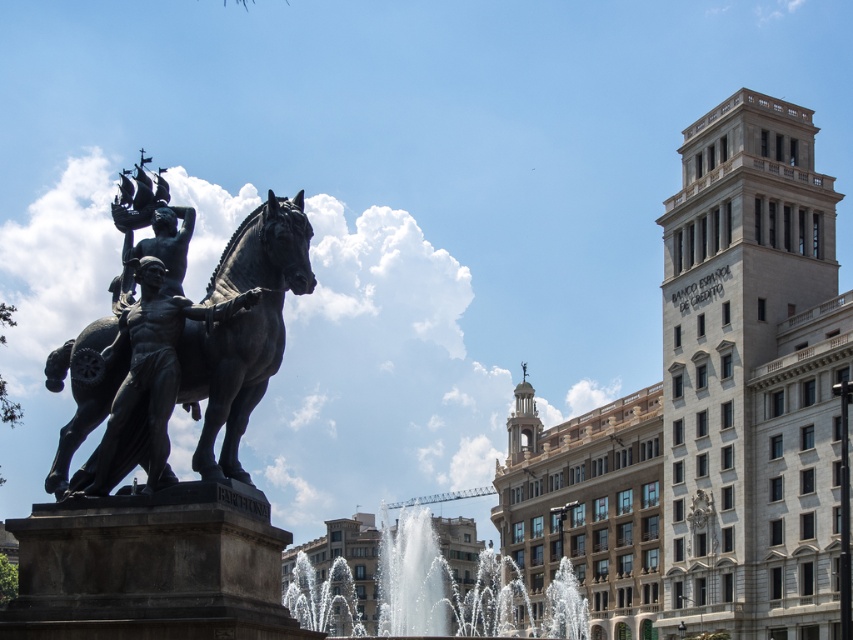
Question: Which object appears closest to the camera in this image?

Choices:
 (A) polished bronze horse at center-left
 (B) beige stone tower at upper right

Answer: (A)

Question: Can you confirm if beige stone tower at upper right is positioned below clear glass water at center?

Choices:
 (A) yes
 (B) no

Answer: (B)

Question: Does beige stone tower at upper right have a larger size compared to polished bronze horse at center-left?

Choices:
 (A) yes
 (B) no

Answer: (A)

Question: Among these points, which one is farthest from the camera?

Choices:
 (A) (351, 588)
 (B) (778, 170)
 (C) (225, 332)

Answer: (A)

Question: Which object is closer to the camera taking this photo?

Choices:
 (A) beige stone tower at upper right
 (B) clear glass water at center
 (C) polished bronze horse at center-left

Answer: (C)

Question: Does polished bronze horse at center-left appear under clear glass water at center?

Choices:
 (A) no
 (B) yes

Answer: (A)